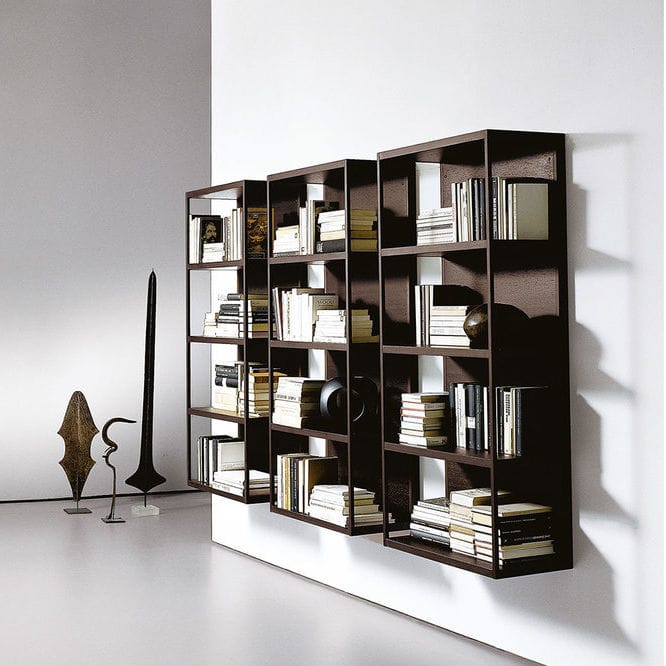
Where is `books stacked on shelf two`? books stacked on shelf two is located at coordinates (204, 328), (232, 310), (222, 328), (260, 304), (254, 324).